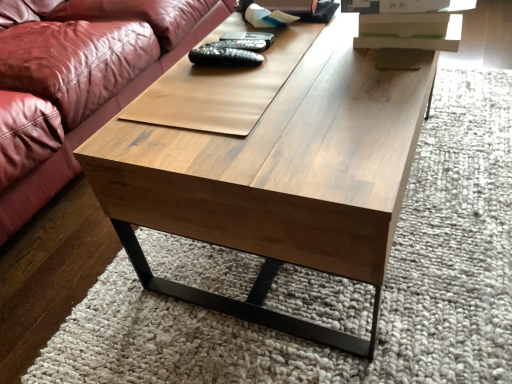
Find the location of `vacant area that lies in front of black plastic remote at center, which ranks as the first remote in top-to-bottom order`. vacant area that lies in front of black plastic remote at center, which ranks as the first remote in top-to-bottom order is located at coordinates (258, 79).